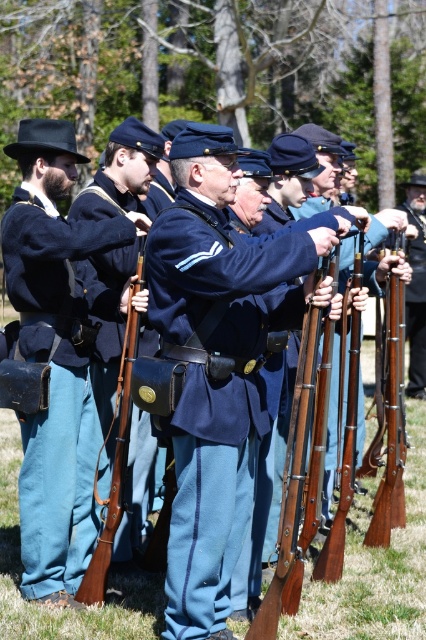
Based on the scene description and the coordinates provided, which object or feature is located at the point marked as point (215, 388)?

The point (215, 388) indicates the navy blue wool uniform at center.

You are a photographer positioned to the left of the scene. You want to capture a photo where the navy blue wool uniform at center and the brown wooden rifle at center are both visible. Which object should you adjust your camera to focus on first to ensure both are in frame?

You should focus on the brown wooden rifle at center first because the navy blue wool uniform at center is to the right of the brown wooden rifle at center. By centering the rifle first, you can then adjust the frame to include the uniform to its right.